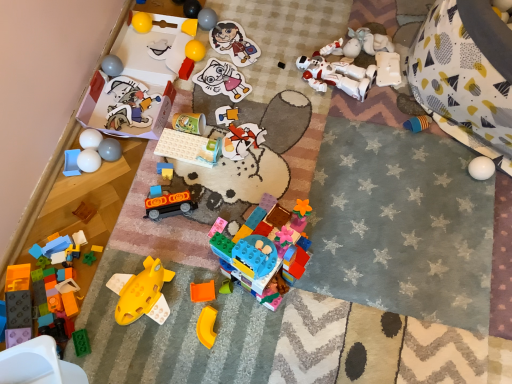
You are a GUI agent. You are given a task and a screenshot of the screen. Output one action in this format:
    pyautogui.click(x=<x>, y=<y>)
    Task: Click on the vacant space to the right of smooth yellow ball at upper center, which is the 15th toy from left to right
    
    Given the screenshot: What is the action you would take?
    pyautogui.click(x=249, y=33)